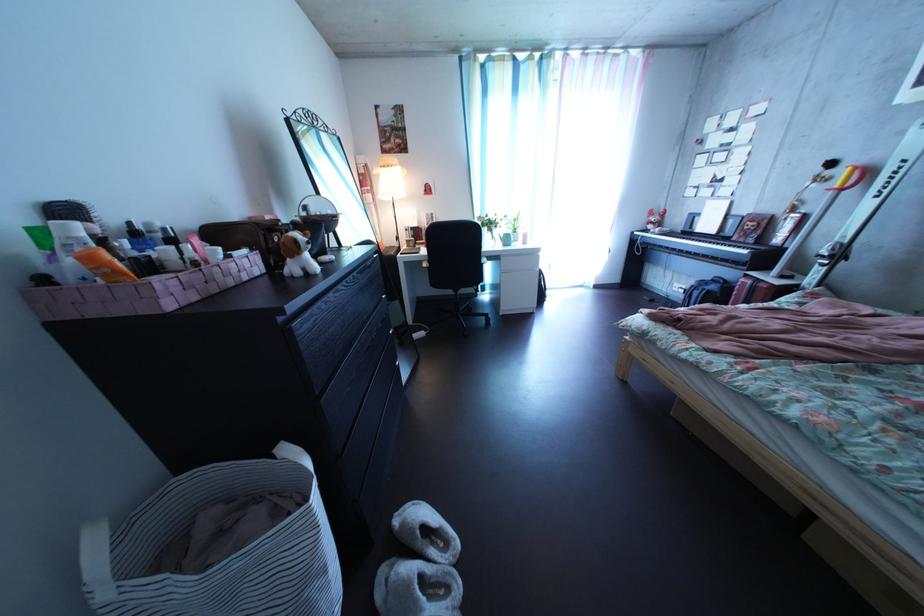
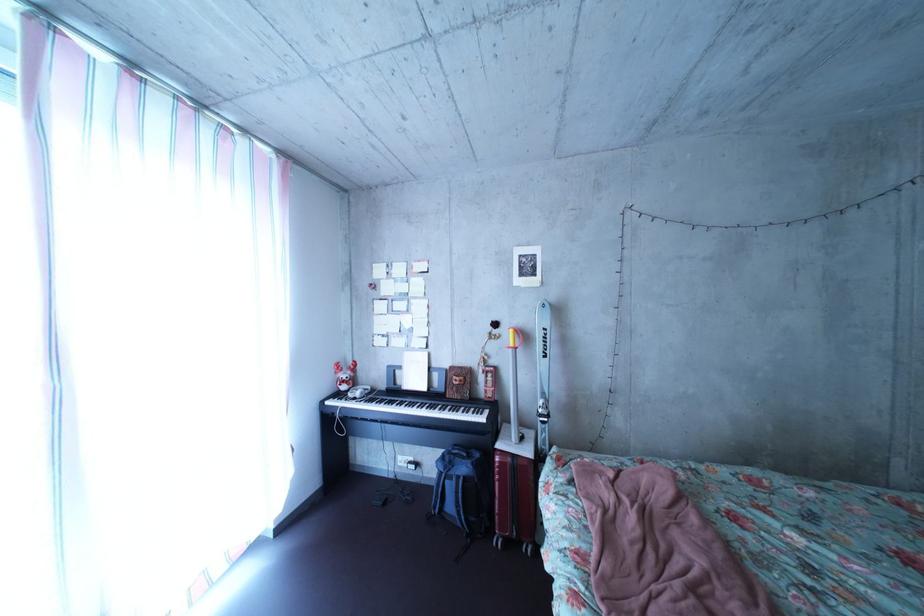
Locate, in the second image, the point that corresponds to [727,294] in the first image.

(479, 477)